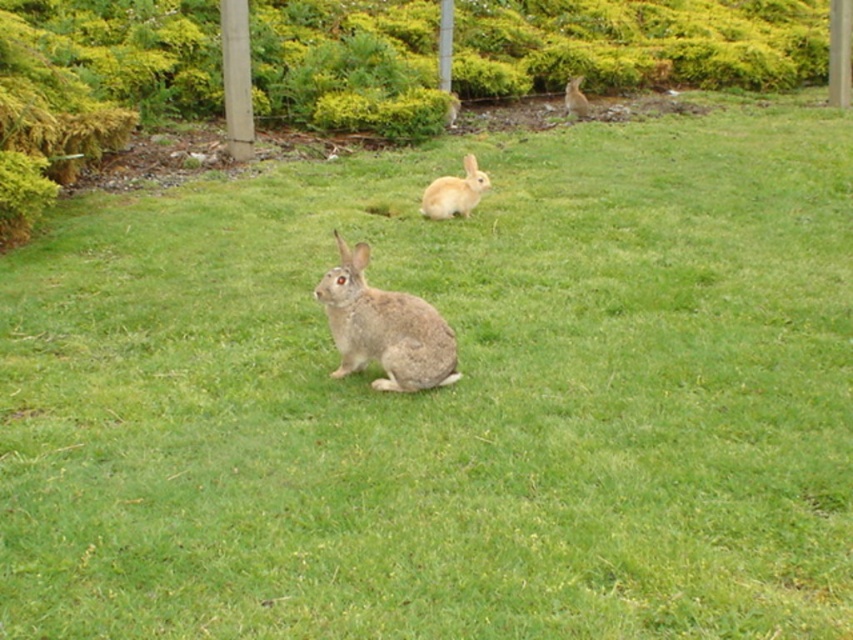
Question: Which is nearer to the fuzzy gray rabbit at center?

Choices:
 (A) fuzzy brown rabbit at upper center
 (B) fuzzy brown rabbit at center

Answer: (B)

Question: Is fuzzy brown rabbit at center further to the viewer compared to fuzzy brown rabbit at upper center?

Choices:
 (A) yes
 (B) no

Answer: (B)

Question: Considering the real-world distances, which object is farthest from the fuzzy brown rabbit at center?

Choices:
 (A) fuzzy brown rabbit at upper center
 (B) fuzzy gray rabbit at center

Answer: (A)

Question: Is fuzzy gray rabbit at center above fuzzy brown rabbit at center?

Choices:
 (A) no
 (B) yes

Answer: (A)

Question: Does fuzzy gray rabbit at center have a larger size compared to fuzzy brown rabbit at upper center?

Choices:
 (A) yes
 (B) no

Answer: (A)

Question: Which of the following is the farthest from the observer?

Choices:
 (A) fuzzy brown rabbit at upper center
 (B) fuzzy brown rabbit at center

Answer: (A)